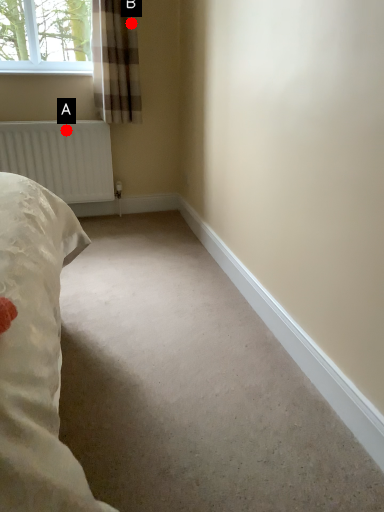
Question: Two points are circled on the image, labeled by A and B beside each circle. Among these points, which one is nearest to the camera?

Choices:
 (A) A is closer
 (B) B is closer

Answer: (B)